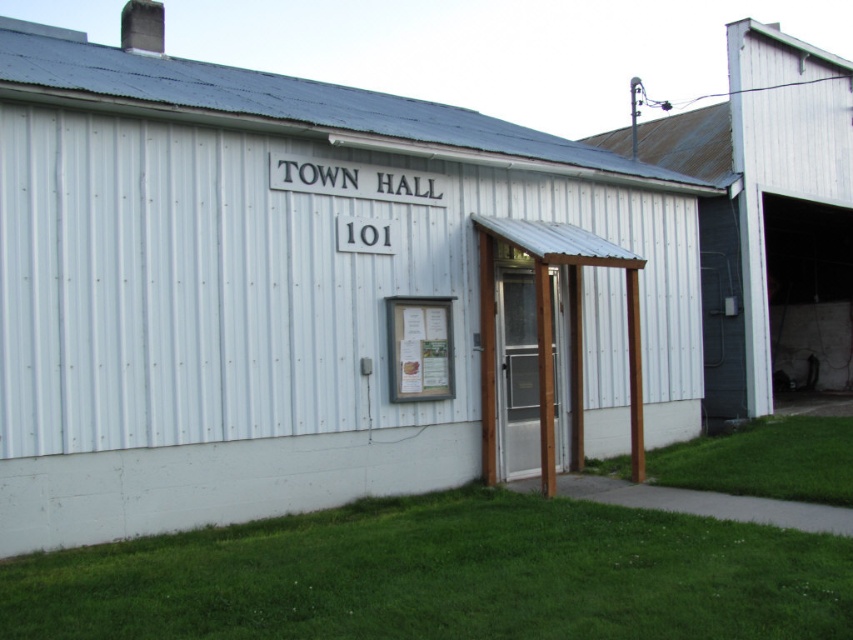
You are standing in front of the TOWN HALL 101 building. You see the green grass at lower center and the white corrugated metal barn at right. Which object is positioned lower in the image?

The green grass at lower center is positioned lower than the white corrugated metal barn at right in the image.

Looking at this image, you are standing in front of the TOWN HALL 101 building. There are two points marked on the building. One is at coordinate point (210, 580) and the other is at point (750, 88). Which point is closer to you?

Point (210, 580) is closer to the viewer than point (750, 88).

You are a painter who needs to cover all surfaces of the white corrugated metal barn at right and the green grass at lower right. If the cost of paint per square meter is the same for both, which one will require more paint?

The white corrugated metal barn at right requires more paint because its width surpasses that of the green grass at lower right, and since both are being painted entirely, the larger surface area would need more paint.